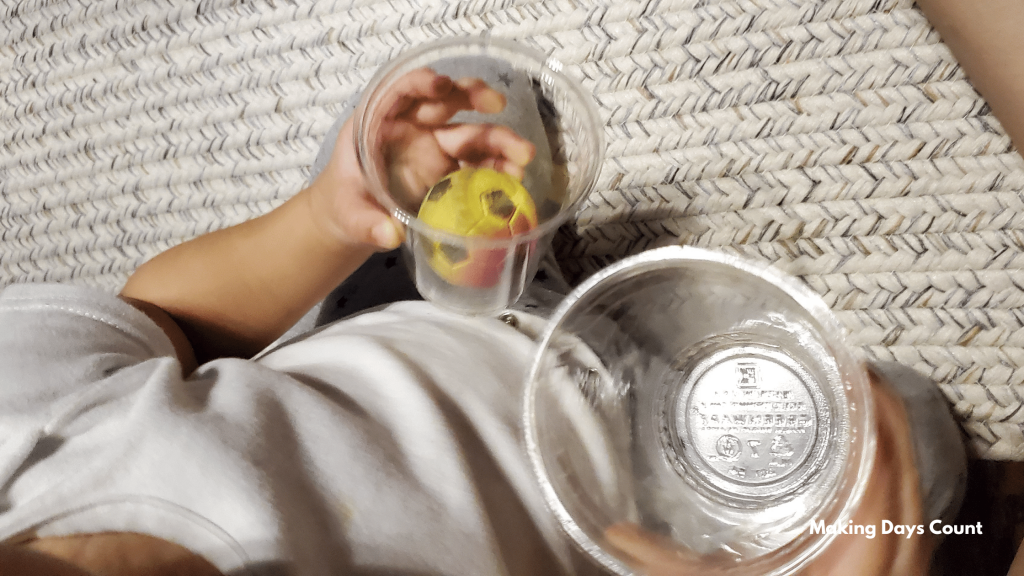
Where is `rug in background of image`? The height and width of the screenshot is (576, 1024). rug in background of image is located at coordinates (831, 147).